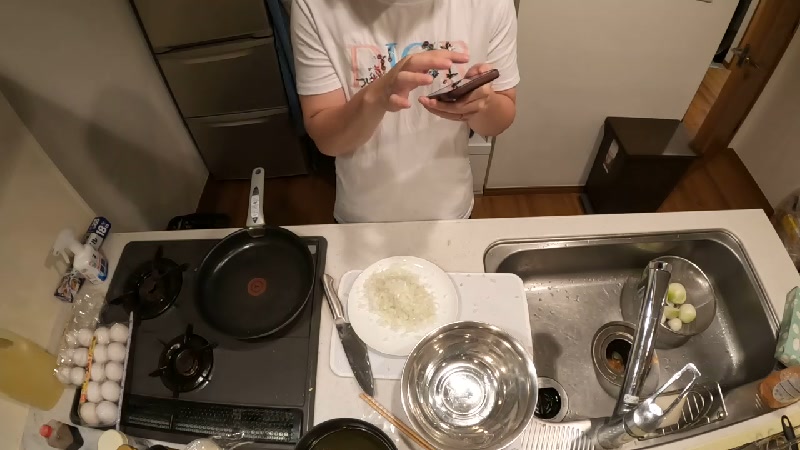
Locate an element on the screen. The image size is (800, 450). sink is located at coordinates (597, 336).